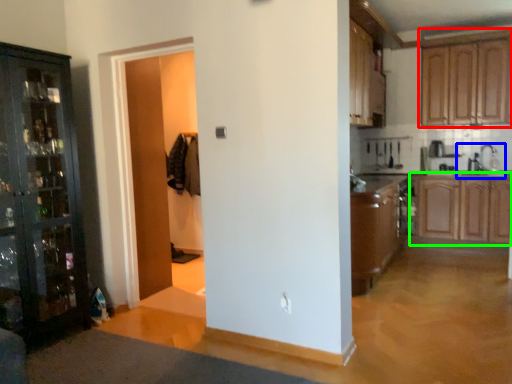
Question: Based on their relative distances, which object is farther from cabinetry (highlighted by a red box)? Choose from sink (highlighted by a blue box) and cabinetry (highlighted by a green box).

Choices:
 (A) sink
 (B) cabinetry

Answer: (B)